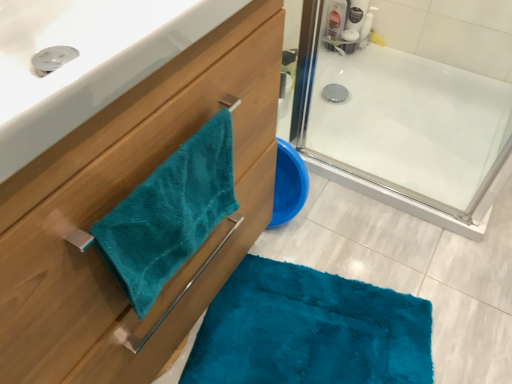
Question: Is translucent plastic bottle at upper right closer to camera compared to teal plush towel at left?

Choices:
 (A) no
 (B) yes

Answer: (A)

Question: From the image's perspective, is translucent plastic bottle at upper right located above teal plush towel at left?

Choices:
 (A) no
 (B) yes

Answer: (B)

Question: Is translucent plastic bottle at upper right aimed at teal plush towel at left?

Choices:
 (A) no
 (B) yes

Answer: (A)

Question: Does translucent plastic bottle at upper right appear on the left side of teal plush towel at left?

Choices:
 (A) no
 (B) yes

Answer: (A)

Question: Is translucent plastic bottle at upper right thinner than teal plush towel at left?

Choices:
 (A) yes
 (B) no

Answer: (A)

Question: Relative to teal plush towel at left, is translucent plastic bottle at upper right in front or behind?

Choices:
 (A) behind
 (B) front

Answer: (A)

Question: Considering the positions of translucent plastic bottle at upper right and teal plush towel at left in the image, is translucent plastic bottle at upper right bigger or smaller than teal plush towel at left?

Choices:
 (A) big
 (B) small

Answer: (B)

Question: Is point (366, 39) positioned closer to the camera than point (166, 190)?

Choices:
 (A) farther
 (B) closer

Answer: (A)

Question: From the image's perspective, relative to teal plush towel at left, is translucent plastic bottle at upper right above or below?

Choices:
 (A) above
 (B) below

Answer: (A)

Question: Is teal plush towel at left taller or shorter than teal plush towel at left?

Choices:
 (A) short
 (B) tall

Answer: (B)

Question: Considering the positions of point (61, 274) and point (142, 221), is point (61, 274) closer or farther from the camera than point (142, 221)?

Choices:
 (A) farther
 (B) closer

Answer: (B)

Question: Is teal plush towel at left inside the boundaries of teal plush towel at left, or outside?

Choices:
 (A) outside
 (B) inside

Answer: (A)

Question: In terms of width, does teal plush towel at left look wider or thinner when compared to teal plush towel at left?

Choices:
 (A) thin
 (B) wide

Answer: (B)

Question: Considering the positions of teal plush towel at left and translucent plastic bottle at upper right in the image, is teal plush towel at left taller or shorter than translucent plastic bottle at upper right?

Choices:
 (A) short
 (B) tall

Answer: (B)

Question: Visually, is teal plush towel at left positioned to the left or to the right of translucent plastic bottle at upper right?

Choices:
 (A) left
 (B) right

Answer: (A)